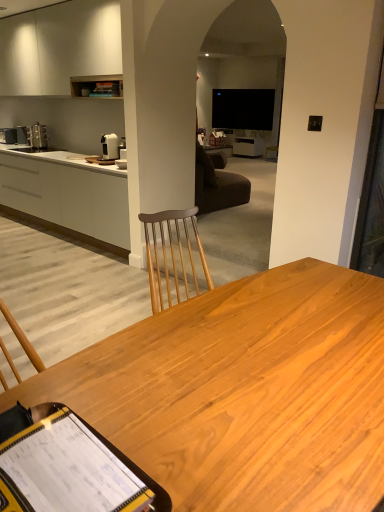
The image size is (384, 512). What do you see at coordinates (67, 194) in the screenshot?
I see `white matte cabinetry at left, the 2th cabinetry when ordered from top to bottom` at bounding box center [67, 194].

Measure the distance between point (87,234) and camera.

Point (87,234) and camera are 4.57 meters apart from each other.

What do you see at coordinates (59, 47) in the screenshot? I see `white matte cabinet at upper left, which appears as the 1th cabinetry when viewed from the top` at bounding box center [59, 47].

You are a GUI agent. You are given a task and a screenshot of the screen. Output one action in this format:
    pyautogui.click(x=<x>, y=<y>)
    Task: Click on the yellow plastic clipboard at lower left
    The width and height of the screenshot is (384, 512).
    Given the screenshot: What is the action you would take?
    pyautogui.click(x=68, y=467)

Considering the relative positions of yellow plastic clipboard at lower left and white matte cabinetry at left, the 2th cabinetry when ordered from top to bottom, in the image provided, is yellow plastic clipboard at lower left behind white matte cabinetry at left, the 2th cabinetry when ordered from top to bottom,?

No, it is in front of white matte cabinetry at left, the 2th cabinetry when ordered from top to bottom.

Which is closer, (24, 436) or (74, 213)?

Point (24, 436) appears to be closer to the viewer than point (74, 213).

Considering the positions of objects yellow plastic clipboard at lower left and white matte cabinetry at left, the 1th cabinetry when ordered from bottom to top, in the image provided, who is more to the left, yellow plastic clipboard at lower left or white matte cabinetry at left, the 1th cabinetry when ordered from bottom to top,?

white matte cabinetry at left, the 1th cabinetry when ordered from bottom to top.

Looking at this image, is yellow plastic clipboard at lower left next to white matte cabinetry at left, the 1th cabinetry when ordered from bottom to top, and touching it?

yellow plastic clipboard at lower left is not next to white matte cabinetry at left, the 1th cabinetry when ordered from bottom to top, and they're not touching.

Visually, is white matte cabinetry at left, the 2th cabinetry when ordered from top to bottom, positioned to the left or to the right of yellow plastic clipboard at lower left?

white matte cabinetry at left, the 2th cabinetry when ordered from top to bottom, is to the left of yellow plastic clipboard at lower left.

The width and height of the screenshot is (384, 512). Find the location of `clipboard located above the white matte cabinetry at left, the 1th cabinetry when ordered from bottom to top (from a real-world perspective)`. clipboard located above the white matte cabinetry at left, the 1th cabinetry when ordered from bottom to top (from a real-world perspective) is located at coordinates (68, 467).

Which is in front, point (38, 172) or point (48, 444)?

The point (48, 444) is closer.

Is white glossy coffee machine at upper left, the 2th coffee machine when ordered from top to bottom, far from yellow plastic clipboard at lower left?

Yes, white glossy coffee machine at upper left, the 2th coffee machine when ordered from top to bottom, and yellow plastic clipboard at lower left are located far from each other.

From the image's perspective, does white glossy coffee machine at upper left, the 2th coffee machine when ordered from top to bottom, appear higher than yellow plastic clipboard at lower left?

Yes, from the image's perspective, white glossy coffee machine at upper left, the 2th coffee machine when ordered from top to bottom, is above yellow plastic clipboard at lower left.

Does white glossy coffee machine at upper left, marked as the 1th coffee machine in a bottom-to-top arrangement, contain yellow plastic clipboard at lower left?

Actually, yellow plastic clipboard at lower left is outside white glossy coffee machine at upper left, marked as the 1th coffee machine in a bottom-to-top arrangement.

Which object is wider, white glossy coffee machine at upper left, marked as the 1th coffee machine in a bottom-to-top arrangement, or yellow plastic clipboard at lower left?

Wider between the two is yellow plastic clipboard at lower left.

From the picture: From the image's perspective, relative to yellow plastic clipboard at lower left, is light brown wood desk at center above or below?

From the image's perspective, light brown wood desk at center appears below yellow plastic clipboard at lower left.

Considering the sizes of light brown wood desk at center and yellow plastic clipboard at lower left in the image, is light brown wood desk at center taller or shorter than yellow plastic clipboard at lower left?

light brown wood desk at center is taller than yellow plastic clipboard at lower left.

Which of these two, light brown wood desk at center or yellow plastic clipboard at lower left, is wider?

Wider between the two is light brown wood desk at center.

Considering the positions of objects white matte cabinet at upper left, which appears as the 1th cabinetry when viewed from the top, and yellow plastic clipboard at lower left in the image provided, who is behind, white matte cabinet at upper left, which appears as the 1th cabinetry when viewed from the top, or yellow plastic clipboard at lower left?

Positioned behind is white matte cabinet at upper left, which appears as the 1th cabinetry when viewed from the top.

Which is behind, point (105, 3) or point (101, 476)?

Positioned behind is point (105, 3).

What are the coordinates of `clipboard located below the white matte cabinet at upper left, the second cabinetry in the bottom-to-top sequence (from the image's perspective)` in the screenshot? It's located at 68,467.

Can we say white matte cabinet at upper left, the second cabinetry in the bottom-to-top sequence, lies outside yellow plastic clipboard at lower left?

white matte cabinet at upper left, the second cabinetry in the bottom-to-top sequence, is positioned outside yellow plastic clipboard at lower left.

I want to click on desk on the right of the white matte cabinet at upper left, the second cabinetry in the bottom-to-top sequence, so click(244, 392).

What's the angular difference between white matte cabinet at upper left, the second cabinetry in the bottom-to-top sequence, and light brown wood desk at center's facing directions?

The facing directions of white matte cabinet at upper left, the second cabinetry in the bottom-to-top sequence, and light brown wood desk at center are 90.9 degrees apart.

Is white matte cabinet at upper left, the second cabinetry in the bottom-to-top sequence, to the left or to the right of light brown wood desk at center in the image?

white matte cabinet at upper left, the second cabinetry in the bottom-to-top sequence, is to the left of light brown wood desk at center.

Looking at this image, is the depth of white matte cabinet at upper left, which appears as the 1th cabinetry when viewed from the top, greater than that of light brown wood desk at center?

Yes, it is behind light brown wood desk at center.

From the image's perspective, does light brown wood desk at center appear higher than white matte cabinet at upper left, which appears as the 1th cabinetry when viewed from the top?

No, from the image's perspective, light brown wood desk at center is not on top of white matte cabinet at upper left, which appears as the 1th cabinetry when viewed from the top.

Looking at this image, is light brown wood desk at center far from white matte cabinet at upper left, which appears as the 1th cabinetry when viewed from the top?

Yes, light brown wood desk at center and white matte cabinet at upper left, which appears as the 1th cabinetry when viewed from the top, are located far from each other.

From a real-world perspective, between light brown wood desk at center and white matte cabinet at upper left, the second cabinetry in the bottom-to-top sequence, who is vertically lower?

light brown wood desk at center is physically lower.

Between light brown wood desk at center and white matte cabinet at upper left, which appears as the 1th cabinetry when viewed from the top, which one has less height?

light brown wood desk at center.

Starting from the yellow plastic clipboard at lower left, which cabinetry is the 2nd one behind? Please provide its 2D coordinates.

[(67, 194)]

In order to click on clipboard below the white matte cabinetry at left, the 2th cabinetry when ordered from top to bottom (from the image's perspective) in this screenshot , I will do `click(68, 467)`.

Estimate the real-world distances between objects in this image. Which object is further from light brown wood desk at center, yellow plastic clipboard at lower left or white glossy coffee machine at upper left, marked as the 1th coffee machine in a bottom-to-top arrangement?

white glossy coffee machine at upper left, marked as the 1th coffee machine in a bottom-to-top arrangement, is positioned further to the anchor light brown wood desk at center.

Based on their spatial positions, is satin silver coffee machine at left, which is the 2th coffee machine from right to left, or yellow plastic clipboard at lower left further from white matte cabinet at upper left, which appears as the 1th cabinetry when viewed from the top?

yellow plastic clipboard at lower left.

Considering their positions, is white matte cabinet at upper left, which appears as the 1th cabinetry when viewed from the top, positioned further to satin silver coffee machine at left, the second coffee machine positioned from the front, than yellow plastic clipboard at lower left?

Among the two, yellow plastic clipboard at lower left is located further to satin silver coffee machine at left, the second coffee machine positioned from the front.

When comparing their distances from white matte cabinet at upper left, the second cabinetry in the bottom-to-top sequence, does white glossy coffee machine at upper left, the 2th coffee machine when ordered from top to bottom, or satin silver coffee machine at left, marked as the 1th coffee machine in a back-to-front arrangement, seem closer?

satin silver coffee machine at left, marked as the 1th coffee machine in a back-to-front arrangement.

Based on the photo, looking at the image, which one is located further to light brown wood desk at center, white glossy coffee machine at upper left, marked as the 1th coffee machine in a bottom-to-top arrangement, or white matte cabinet at upper left, the second cabinetry in the bottom-to-top sequence?

white matte cabinet at upper left, the second cabinetry in the bottom-to-top sequence, is positioned further to the anchor light brown wood desk at center.

In the scene shown: Which object lies further to the anchor point light brown wood desk at center, yellow plastic clipboard at lower left or white matte cabinet at upper left, which appears as the 1th cabinetry when viewed from the top?

white matte cabinet at upper left, which appears as the 1th cabinetry when viewed from the top, is positioned further to the anchor light brown wood desk at center.

From the image, which object appears to be farther from white matte cabinet at upper left, which appears as the 1th cabinetry when viewed from the top, satin silver coffee machine at left, positioned as the second coffee machine in bottom-to-top order, or white matte cabinetry at left, the 1th cabinetry when ordered from bottom to top?

Based on the image, white matte cabinetry at left, the 1th cabinetry when ordered from bottom to top, appears to be further to white matte cabinet at upper left, which appears as the 1th cabinetry when viewed from the top.

Based on their spatial positions, is white matte cabinet at upper left, which appears as the 1th cabinetry when viewed from the top, or satin silver coffee machine at left, the second coffee machine positioned from the front, further from white glossy coffee machine at upper left, which is counted as the second coffee machine, starting from the back?

white matte cabinet at upper left, which appears as the 1th cabinetry when viewed from the top.

Where is `coffee machine between white matte cabinetry at left, the 1th cabinetry when ordered from bottom to top, and satin silver coffee machine at left, arranged as the first coffee machine when viewed from the top, in the front-back direction`? The width and height of the screenshot is (384, 512). coffee machine between white matte cabinetry at left, the 1th cabinetry when ordered from bottom to top, and satin silver coffee machine at left, arranged as the first coffee machine when viewed from the top, in the front-back direction is located at coordinates (110, 146).

Identify the location of clipboard between light brown wood desk at center and white matte cabinetry at left, the 1th cabinetry when ordered from bottom to top, along the z-axis. The width and height of the screenshot is (384, 512). (68, 467).

Locate an element on the screen. Image resolution: width=384 pixels, height=512 pixels. cabinetry between light brown wood desk at center and white matte cabinetry at left, the 1th cabinetry when ordered from bottom to top, in the front-back direction is located at coordinates (59, 47).

The image size is (384, 512). I want to click on coffee machine between white matte cabinet at upper left, the second cabinetry in the bottom-to-top sequence, and satin silver coffee machine at left, arranged as the first coffee machine when viewed from the top, along the z-axis, so click(110, 146).